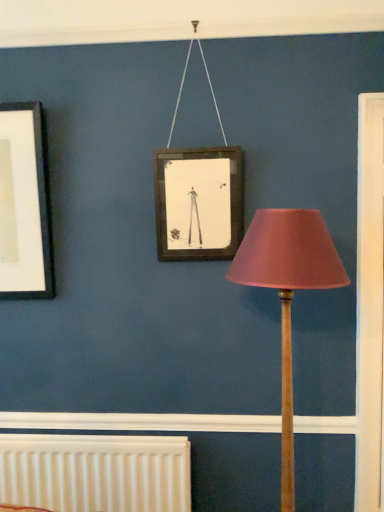
Image resolution: width=384 pixels, height=512 pixels. Describe the element at coordinates (287, 292) in the screenshot. I see `pink fabric lampshade at right` at that location.

Measure the distance between pink fabric lampshade at right and camera.

pink fabric lampshade at right and camera are 1.26 meters apart from each other.

Identify the location of pink fabric lampshade at right. (287, 292).

Where is `pink fabric lampshade at right`? pink fabric lampshade at right is located at coordinates (287, 292).